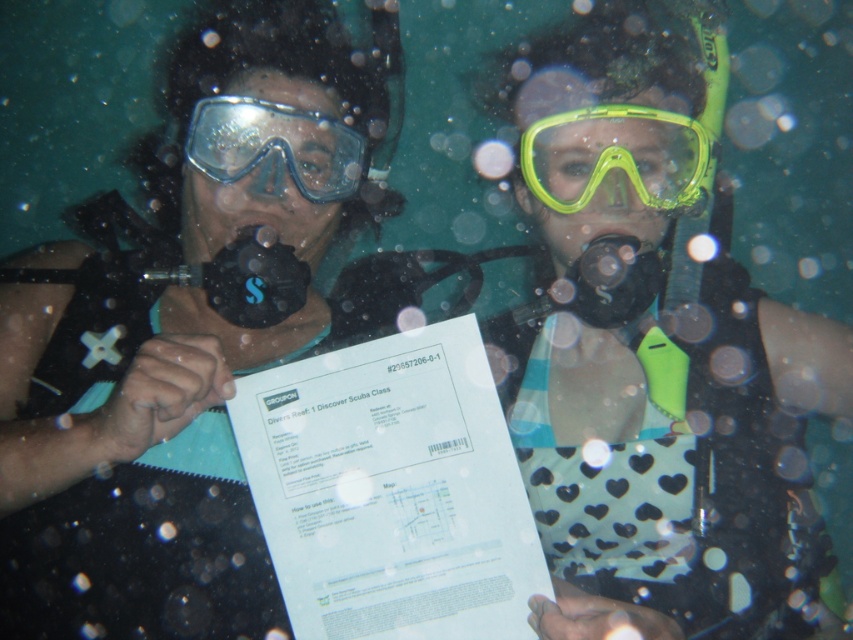
Question: Which of the following is the closest to the observer?

Choices:
 (A) (560, 125)
 (B) (334, 134)
 (C) (289, 0)

Answer: (A)

Question: Does matte black wetsuit at left have a greater width compared to yellow matte/glossy goggles at center?

Choices:
 (A) yes
 (B) no

Answer: (A)

Question: Is yellow matte/glossy goggles at center to the left of transparent plastic goggles at upper center from the viewer's perspective?

Choices:
 (A) yes
 (B) no

Answer: (B)

Question: Which of the following is the farthest from the observer?

Choices:
 (A) (662, 122)
 (B) (294, 301)
 (C) (219, 150)

Answer: (B)

Question: Does matte black wetsuit at left have a greater width compared to transparent plastic goggles at upper center?

Choices:
 (A) no
 (B) yes

Answer: (B)

Question: Which of the following is the closest to the observer?

Choices:
 (A) (45, 481)
 (B) (639, 112)

Answer: (A)